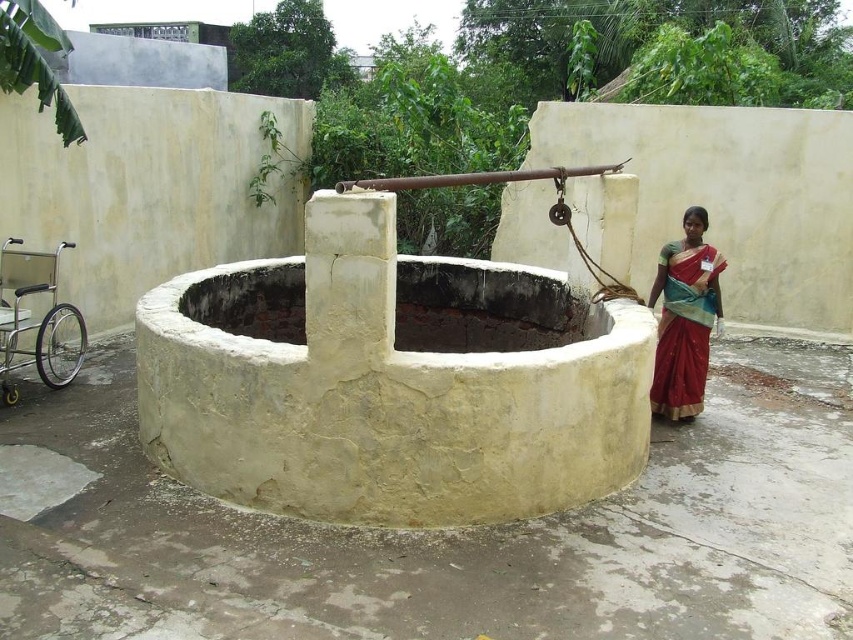
Question: Is smooth concrete well at center below red silk sari at right?

Choices:
 (A) yes
 (B) no

Answer: (A)

Question: Which is nearer to the red silk sari at right?

Choices:
 (A) smooth concrete well at center
 (B) silver metallic wheelchair at lower left

Answer: (A)

Question: Which of the following is the closest to the observer?

Choices:
 (A) (688, 300)
 (B) (44, 275)

Answer: (A)

Question: Which object is positioned farthest from the red silk sari at right?

Choices:
 (A) silver metallic wheelchair at lower left
 (B) smooth concrete well at center

Answer: (A)

Question: Does smooth concrete well at center appear on the right side of silver metallic wheelchair at lower left?

Choices:
 (A) no
 (B) yes

Answer: (B)

Question: Does smooth concrete well at center have a lesser width compared to red silk sari at right?

Choices:
 (A) yes
 (B) no

Answer: (A)